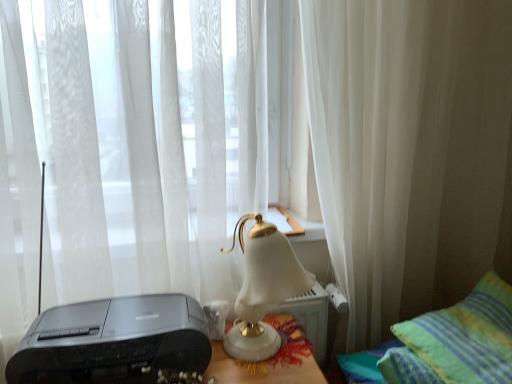
Where is `white sheer curtain at center, the second curtain when ordered from left to right`? The image size is (512, 384). white sheer curtain at center, the second curtain when ordered from left to right is located at coordinates (374, 153).

I want to click on matte black printer at lower left, so click(113, 341).

At what (x,y) coordinates should I click in order to perform the action: click on white sheer curtain at center, arranged as the 1th curtain when viewed from the left. Please return your answer as a coordinate pair (x, y). This screenshot has height=384, width=512. Looking at the image, I should click on (118, 149).

Describe the element at coordinates (457, 340) in the screenshot. The height and width of the screenshot is (384, 512). I see `green striped pillow at lower right` at that location.

You are a GUI agent. You are given a task and a screenshot of the screen. Output one action in this format:
    pyautogui.click(x=<x>, y=<y>)
    Task: Click on the green striped pillow at lower right
    
    Given the screenshot: What is the action you would take?
    pyautogui.click(x=457, y=340)

I want to click on white sheer curtain at center, the second curtain when ordered from left to right, so (x=374, y=153).

Is white porcelain lamp at center closer to the viewer compared to white sheer curtain at center, positioned as the 2th curtain in right-to-left order?

No, white porcelain lamp at center is further to the viewer.

Who is shorter, white porcelain lamp at center or white sheer curtain at center, arranged as the 1th curtain when viewed from the left?

white porcelain lamp at center is shorter.

Is white porcelain lamp at center wider than white sheer curtain at center, arranged as the 1th curtain when viewed from the left?

In fact, white porcelain lamp at center might be narrower than white sheer curtain at center, arranged as the 1th curtain when viewed from the left.

Is white porcelain lamp at center inside or outside of white sheer curtain at center, arranged as the 1th curtain when viewed from the left?

white porcelain lamp at center is not inside white sheer curtain at center, arranged as the 1th curtain when viewed from the left, it's outside.

In the scene shown: Is white sheer curtain at center, placed as the 1th curtain when sorted from right to left, bigger than matte black printer at lower left?

Yes.

Which is behind, white sheer curtain at center, placed as the 1th curtain when sorted from right to left, or matte black printer at lower left?

white sheer curtain at center, placed as the 1th curtain when sorted from right to left, is further away from the camera.

Does white sheer curtain at center, the second curtain when ordered from left to right, have a greater width compared to matte black printer at lower left?

No.

Could you tell me if white sheer curtain at center, placed as the 1th curtain when sorted from right to left, is facing matte black printer at lower left?

No, white sheer curtain at center, placed as the 1th curtain when sorted from right to left, is not oriented towards matte black printer at lower left.

Looking at this image, between white sheer curtain at center, the second curtain when ordered from left to right, and white sheer curtain at center, arranged as the 1th curtain when viewed from the left, which one appears on the left side from the viewer's perspective?

Positioned to the left is white sheer curtain at center, arranged as the 1th curtain when viewed from the left.

Between white sheer curtain at center, placed as the 1th curtain when sorted from right to left, and white sheer curtain at center, positioned as the 2th curtain in right-to-left order, which one has more height?

white sheer curtain at center, placed as the 1th curtain when sorted from right to left.

Is white sheer curtain at center, placed as the 1th curtain when sorted from right to left, facing towards white sheer curtain at center, positioned as the 2th curtain in right-to-left order?

No, white sheer curtain at center, placed as the 1th curtain when sorted from right to left, is not oriented towards white sheer curtain at center, positioned as the 2th curtain in right-to-left order.

From the image's perspective, which is above, white sheer curtain at center, positioned as the 2th curtain in right-to-left order, or white porcelain lamp at center?

white sheer curtain at center, positioned as the 2th curtain in right-to-left order, from the image's perspective.

Is white sheer curtain at center, arranged as the 1th curtain when viewed from the left, at the left side of white porcelain lamp at center?

Indeed, white sheer curtain at center, arranged as the 1th curtain when viewed from the left, is positioned on the left side of white porcelain lamp at center.

Is white sheer curtain at center, arranged as the 1th curtain when viewed from the left, not close to white porcelain lamp at center?

No, white sheer curtain at center, arranged as the 1th curtain when viewed from the left, is not far away from white porcelain lamp at center.

Is white sheer curtain at center, positioned as the 2th curtain in right-to-left order, inside or outside of white sheer curtain at center, placed as the 1th curtain when sorted from right to left?

white sheer curtain at center, positioned as the 2th curtain in right-to-left order, exists outside the volume of white sheer curtain at center, placed as the 1th curtain when sorted from right to left.

Considering the relative sizes of white sheer curtain at center, arranged as the 1th curtain when viewed from the left, and white sheer curtain at center, the second curtain when ordered from left to right, in the image provided, is white sheer curtain at center, arranged as the 1th curtain when viewed from the left, smaller than white sheer curtain at center, the second curtain when ordered from left to right,?

Incorrect, white sheer curtain at center, arranged as the 1th curtain when viewed from the left, is not smaller in size than white sheer curtain at center, the second curtain when ordered from left to right.

How many degrees apart are the facing directions of white sheer curtain at center, arranged as the 1th curtain when viewed from the left, and white sheer curtain at center, the second curtain when ordered from left to right?

The facing directions of white sheer curtain at center, arranged as the 1th curtain when viewed from the left, and white sheer curtain at center, the second curtain when ordered from left to right, are 0.00337 degrees apart.

Is white sheer curtain at center, arranged as the 1th curtain when viewed from the left, wider or thinner than white sheer curtain at center, the second curtain when ordered from left to right?

Clearly, white sheer curtain at center, arranged as the 1th curtain when viewed from the left, has more width compared to white sheer curtain at center, the second curtain when ordered from left to right.

Are white sheer curtain at center, arranged as the 1th curtain when viewed from the left, and green striped pillow at lower right located far from each other?

They are positioned close to each other.

Can you confirm if white sheer curtain at center, arranged as the 1th curtain when viewed from the left, is bigger than green striped pillow at lower right?

Yes, white sheer curtain at center, arranged as the 1th curtain when viewed from the left, is bigger than green striped pillow at lower right.

The height and width of the screenshot is (384, 512). Find the location of `furniture to the right of white sheer curtain at center, arranged as the 1th curtain when viewed from the left`. furniture to the right of white sheer curtain at center, arranged as the 1th curtain when viewed from the left is located at coordinates (457, 340).

Does white sheer curtain at center, positioned as the 2th curtain in right-to-left order, contain green striped pillow at lower right?

Actually, green striped pillow at lower right is outside white sheer curtain at center, positioned as the 2th curtain in right-to-left order.

Which is correct: matte black printer at lower left is inside white sheer curtain at center, placed as the 1th curtain when sorted from right to left, or outside of it?

The correct answer is: outside.

From the picture: Considering their positions, is matte black printer at lower left located in front of or behind white sheer curtain at center, placed as the 1th curtain when sorted from right to left?

matte black printer at lower left is in front of white sheer curtain at center, placed as the 1th curtain when sorted from right to left.

Is white sheer curtain at center, the second curtain when ordered from left to right, at the back of matte black printer at lower left?

No, matte black printer at lower left is not facing the opposite direction of white sheer curtain at center, the second curtain when ordered from left to right.

Locate an element on the screen. Image resolution: width=512 pixels, height=384 pixels. curtain that is in front of the white porcelain lamp at center is located at coordinates (118, 149).

Where is `curtain that is the 2nd object above the matte black printer at lower left (from a real-world perspective)`? This screenshot has width=512, height=384. curtain that is the 2nd object above the matte black printer at lower left (from a real-world perspective) is located at coordinates (374, 153).

Considering their positions, is white porcelain lamp at center positioned closer to matte black printer at lower left than white sheer curtain at center, the second curtain when ordered from left to right?

Based on the image, white porcelain lamp at center appears to be nearer to matte black printer at lower left.

Which object lies further to the anchor point white sheer curtain at center, the second curtain when ordered from left to right, white porcelain lamp at center or matte black printer at lower left?

Among the two, matte black printer at lower left is located further to white sheer curtain at center, the second curtain when ordered from left to right.

Which object lies further to the anchor point matte black printer at lower left, green striped pillow at lower right or white sheer curtain at center, positioned as the 2th curtain in right-to-left order?

green striped pillow at lower right.

Considering their positions, is white sheer curtain at center, positioned as the 2th curtain in right-to-left order, positioned further to matte black printer at lower left than white porcelain lamp at center?

white sheer curtain at center, positioned as the 2th curtain in right-to-left order, lies further to matte black printer at lower left than the other object.

Estimate the real-world distances between objects in this image. Which object is closer to white porcelain lamp at center, matte black printer at lower left or white sheer curtain at center, placed as the 1th curtain when sorted from right to left?

matte black printer at lower left is positioned closer to the anchor white porcelain lamp at center.

Which object lies nearer to the anchor point matte black printer at lower left, white sheer curtain at center, positioned as the 2th curtain in right-to-left order, or green striped pillow at lower right?

white sheer curtain at center, positioned as the 2th curtain in right-to-left order, is closer to matte black printer at lower left.

Based on their spatial positions, is green striped pillow at lower right or white porcelain lamp at center closer to white sheer curtain at center, placed as the 1th curtain when sorted from right to left?

The object closer to white sheer curtain at center, placed as the 1th curtain when sorted from right to left, is green striped pillow at lower right.

Looking at the image, which one is located further to white sheer curtain at center, the second curtain when ordered from left to right, white sheer curtain at center, positioned as the 2th curtain in right-to-left order, or matte black printer at lower left?

Among the two, matte black printer at lower left is located further to white sheer curtain at center, the second curtain when ordered from left to right.

This screenshot has width=512, height=384. I want to click on curtain between white porcelain lamp at center and green striped pillow at lower right, so click(x=374, y=153).

Find the location of a particular element. This screenshot has width=512, height=384. lamp between white sheer curtain at center, positioned as the 2th curtain in right-to-left order, and green striped pillow at lower right, in the horizontal direction is located at coordinates [263, 288].

Find the location of `curtain between matte black printer at lower left and green striped pillow at lower right in the horizontal direction`. curtain between matte black printer at lower left and green striped pillow at lower right in the horizontal direction is located at coordinates (374, 153).

Identify the location of lamp between matte black printer at lower left and green striped pillow at lower right in the horizontal direction. The width and height of the screenshot is (512, 384). (263, 288).